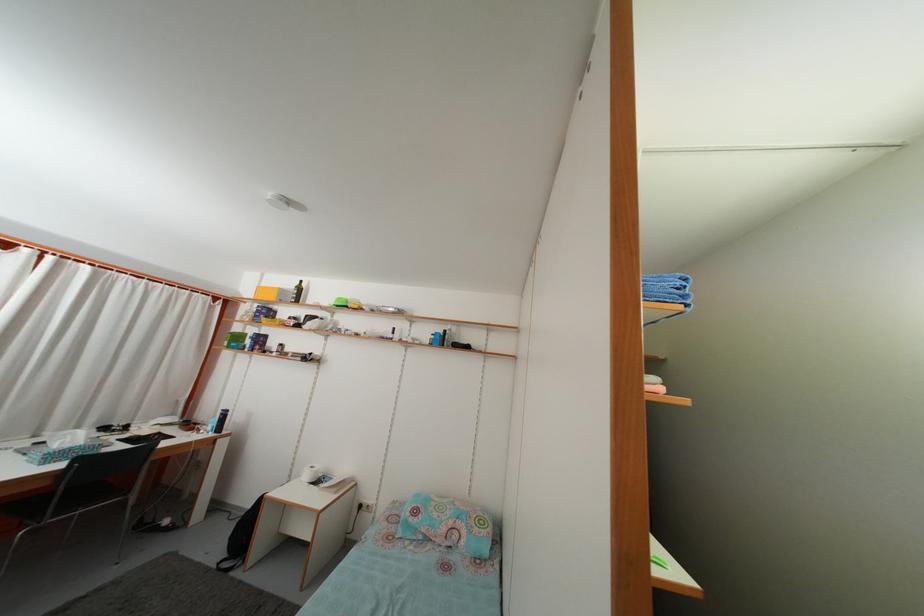
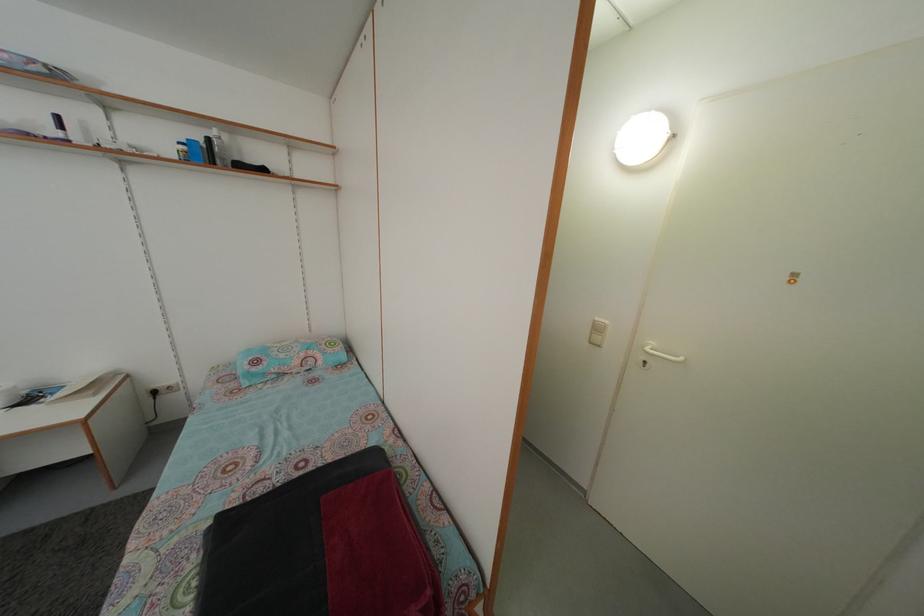
From the picture: First-person continuous shooting, in which direction is the camera rotating?

The camera rotated toward right-down.